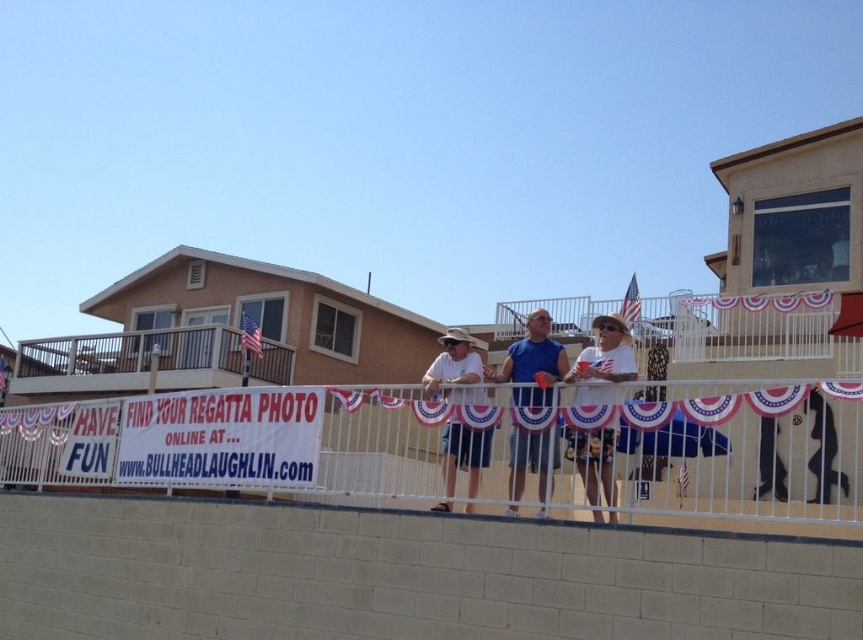
Does white metal fence at center have a larger size compared to white painted wood at upper left?

Correct, white metal fence at center is larger in size than white painted wood at upper left.

Consider the image. Does white metal fence at center come in front of white painted wood at upper left?

Yes, white metal fence at center is closer to the viewer.

Is point (92, 429) farther from camera compared to point (99, 333)?

That is False.

Where is `white metal fence at center`? white metal fence at center is located at coordinates (439, 449).

Who is lower down, blue cotton shirt at center or matte white hat at center?

blue cotton shirt at center is lower down.

Is blue cotton shirt at center positioned in front of matte white hat at center?

Yes, blue cotton shirt at center is in front of matte white hat at center.

Where is `blue cotton shirt at center`? The height and width of the screenshot is (640, 863). blue cotton shirt at center is located at coordinates (532, 364).

Who is higher up, white metal fence at center or blue cotton shirt at center?

blue cotton shirt at center is above.

Is white metal fence at center in front of blue cotton shirt at center?

That is True.

Who is more forward, (x=742, y=429) or (x=526, y=356)?

Point (x=526, y=356) is more forward.

Find the location of a particular element. The image size is (863, 640). white metal fence at center is located at coordinates (439, 449).